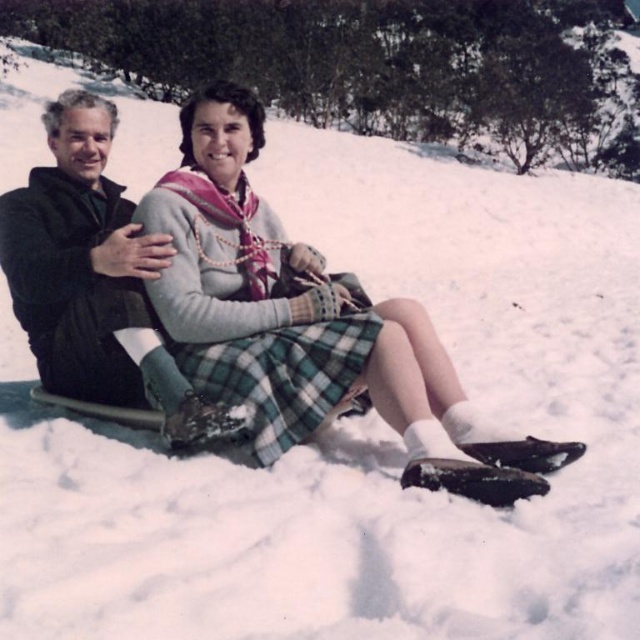
Is point (440, 464) less distant than point (112, 241)?

Yes, it is in front of point (112, 241).

Does green plaid skirt at center have a greater height compared to black matte jacket at left?

Yes, green plaid skirt at center is taller than black matte jacket at left.

Which is behind, point (417, 461) or point (236, 428)?

Point (236, 428)

Identify the location of green plaid skirt at center. (307, 323).